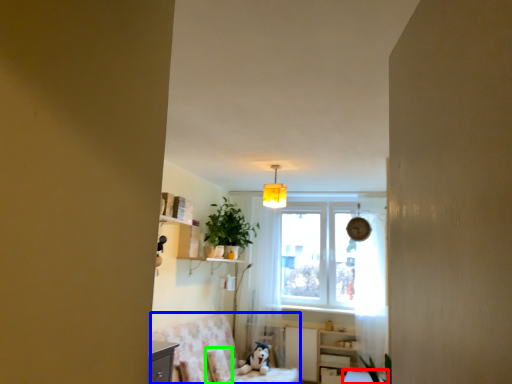
Question: Which is farther away from table (highlighted by a red box)? swivel chair (highlighted by a blue box) or pillow (highlighted by a green box)?

Choices:
 (A) swivel chair
 (B) pillow

Answer: (B)